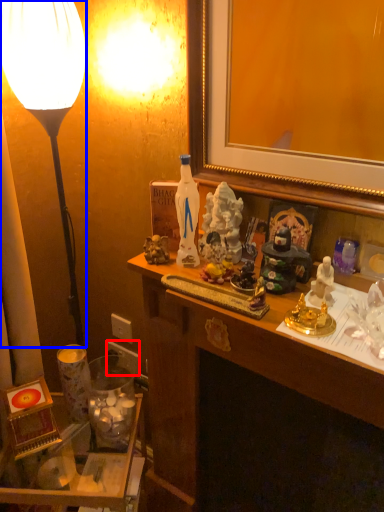
Question: Which of the following is the farthest to the observer, power outlet (highlighted by a red box) or lamp (highlighted by a blue box)?

Choices:
 (A) power outlet
 (B) lamp

Answer: (A)